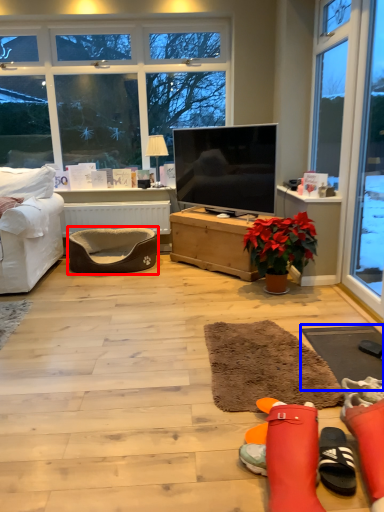
Question: Which object is further to the camera taking this photo, footrest (highlighted by a red box) or flat (highlighted by a blue box)?

Choices:
 (A) footrest
 (B) flat

Answer: (A)